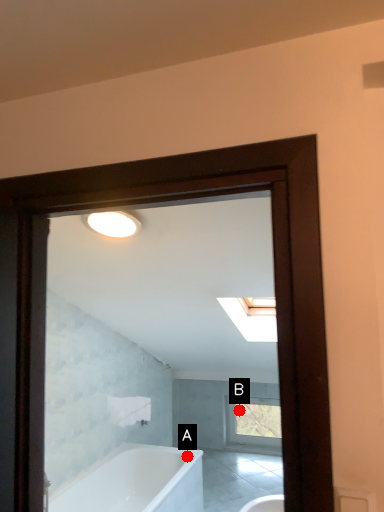
Question: Two points are circled on the image, labeled by A and B beside each circle. Which point is further to the camera?

Choices:
 (A) A is further
 (B) B is further

Answer: (B)